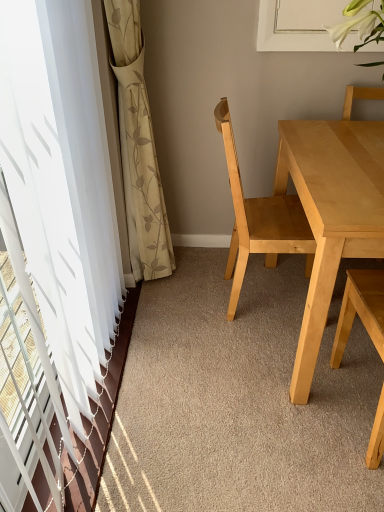
Question: Considering the positions of light wood chair at right, the first chair viewed from the right, and light wood chair at center, the 2th chair in the right-to-left sequence, in the image, is light wood chair at right, the first chair viewed from the right, wider or thinner than light wood chair at center, the 2th chair in the right-to-left sequence,?

Choices:
 (A) wide
 (B) thin

Answer: (B)

Question: Is light wood chair at right, the first chair viewed from the right, inside or outside of light wood chair at center, the first chair in the left-to-right sequence?

Choices:
 (A) inside
 (B) outside

Answer: (B)

Question: Which object is positioned farthest from the beige floral fabric curtain at left?

Choices:
 (A) light wood chair at right, the 2th chair viewed from the left
 (B) white sheer curtain at left
 (C) light wood table at center
 (D) light wood chair at center, the 2th chair in the right-to-left sequence

Answer: (A)

Question: Which of these objects is positioned closest to the light wood chair at right, the 2th chair viewed from the left?

Choices:
 (A) beige floral fabric curtain at left
 (B) light wood chair at center, the 2th chair in the right-to-left sequence
 (C) white sheer curtain at left
 (D) light wood table at center

Answer: (D)